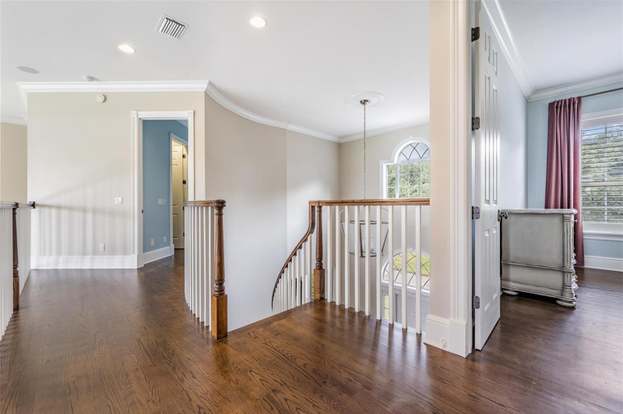
Find the location of `curtains`. curtains is located at coordinates (558, 144).